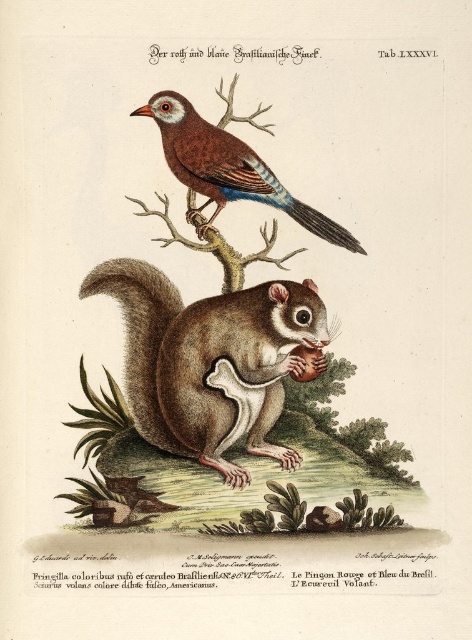
What are the coordinates of the brown furry squirrel at lower center?

The coordinates of the brown furry squirrel at lower center are at point (x=210, y=360).

You are an observer looking at the botanical illustration. You see a smooth brown squirrel at center and a brown furry squirrel at lower center. Which squirrel is located to the left of the other?

The smooth brown squirrel at center is positioned on the left side of brown furry squirrel at lower center.

You are an animal researcher observing the two squirrels in the botanical illustration. Which squirrel has a greater width between the smooth brown squirrel at center and the brown furry squirrel at lower center?

The smooth brown squirrel at center has a greater width than the brown furry squirrel at lower center.